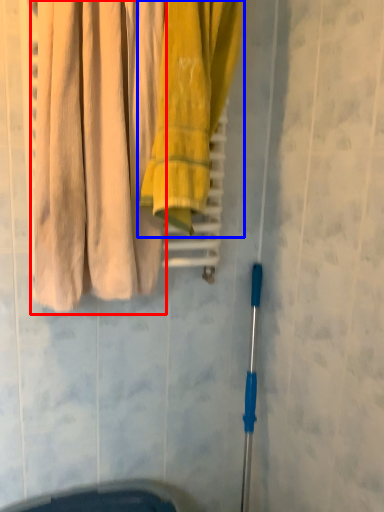
Question: Which of the following is the closest to the observer, curtain (highlighted by a red box) or towel (highlighted by a blue box)?

Choices:
 (A) curtain
 (B) towel

Answer: (A)